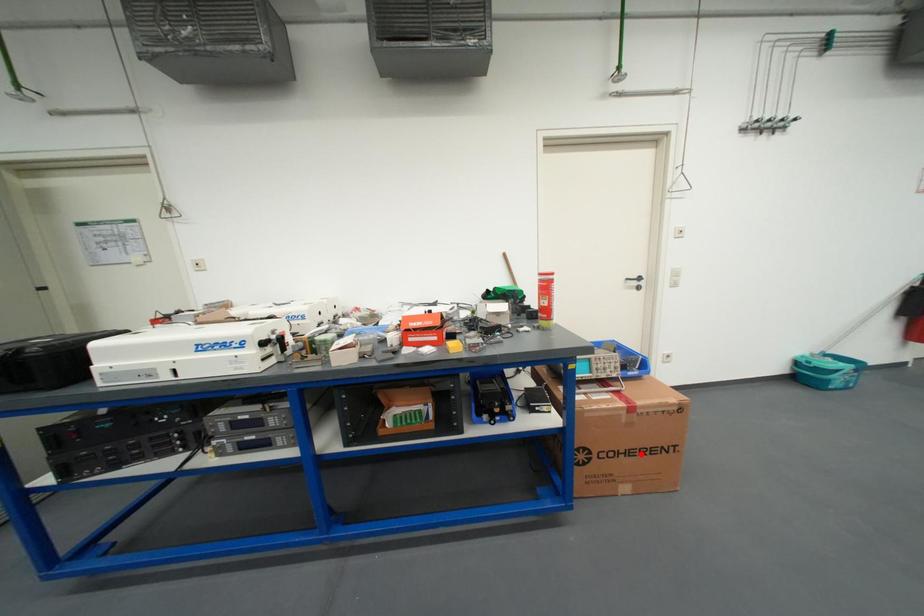
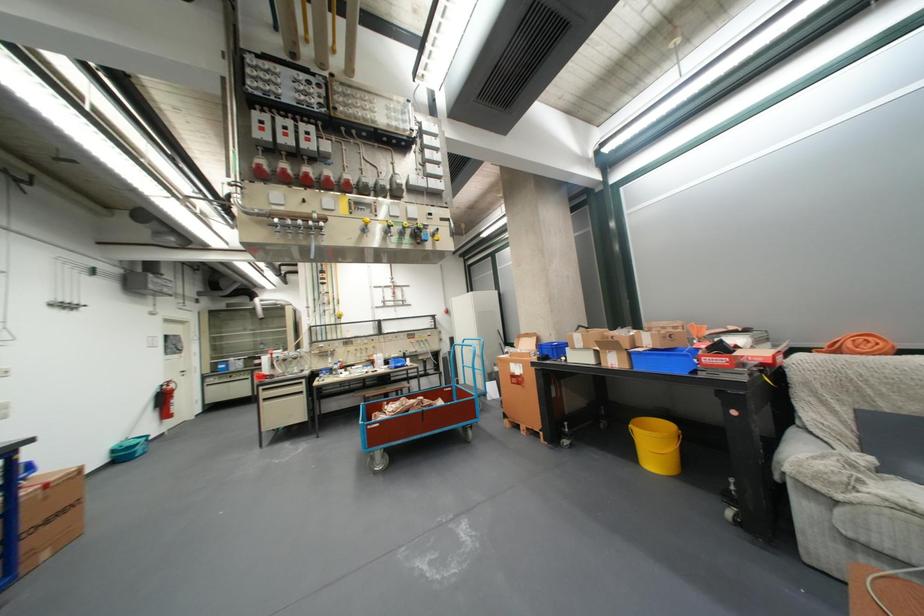
The point at the highlighted location is marked in the first image. Where is the corresponding point in the second image?

(59, 523)